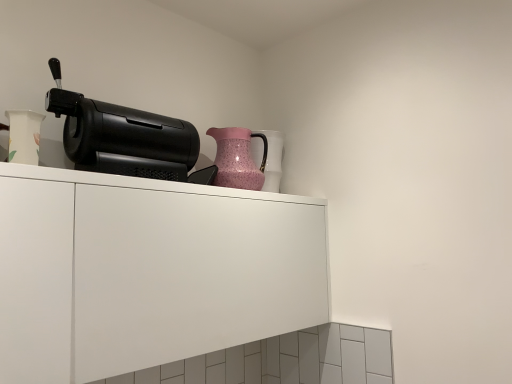
Question: In the image, is pink speckled glass jug at upper right positioned in front of or behind white matte cabinet at upper center?

Choices:
 (A) front
 (B) behind

Answer: (B)

Question: Choose the correct answer: Is pink speckled glass jug at upper right inside white matte cabinet at upper center or outside it?

Choices:
 (A) outside
 (B) inside

Answer: (A)

Question: Which is nearer to the pink textured vase at upper center, placed as the 1th vase when sorted from right to left?

Choices:
 (A) white matte cabinet at upper center
 (B) pink speckled glass jug at upper right
 (C) white glossy vase at left, which is counted as the second vase, starting from the back
 (D) black plastic coffee machine at upper left

Answer: (B)

Question: Which of these objects is positioned closest to the pink speckled glass jug at upper right?

Choices:
 (A) black plastic coffee machine at upper left
 (B) white glossy vase at left, which is the first vase in front-to-back order
 (C) white matte cabinet at upper center
 (D) pink textured vase at upper center, positioned as the second vase in front-to-back order

Answer: (D)